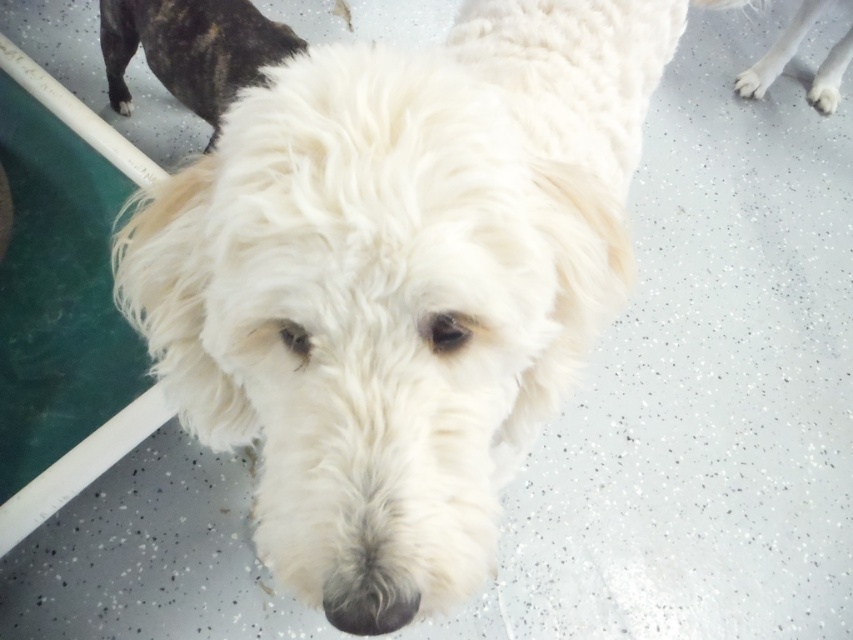
You are a pet groomer observing the image. You notice the black speckled fur at upper left and the white fluffy dog at upper right. Based on their positions, which object is closer to the bottom of the frame?

The black speckled fur at upper left is located below the white fluffy dog at upper right, so it is closer to the bottom of the frame.

You are a photographer setting up a shoot with a black speckled fur at upper left and a white fluffy dog at upper right in the frame. Which object is positioned higher in the image?

The black speckled fur at upper left is taller than the white fluffy dog at upper right, so the black speckled fur at upper left is positioned higher in the image.

You are standing in front of the dog and want to place a treat between the two points labeled point (202, 8) and point (741, 92). Which point should you place the treat closer to so that it is nearer to your hand?

You should place the treat closer to point (202, 8) because it is closer to the camera, which means it is nearer to your hand than point (741, 92).